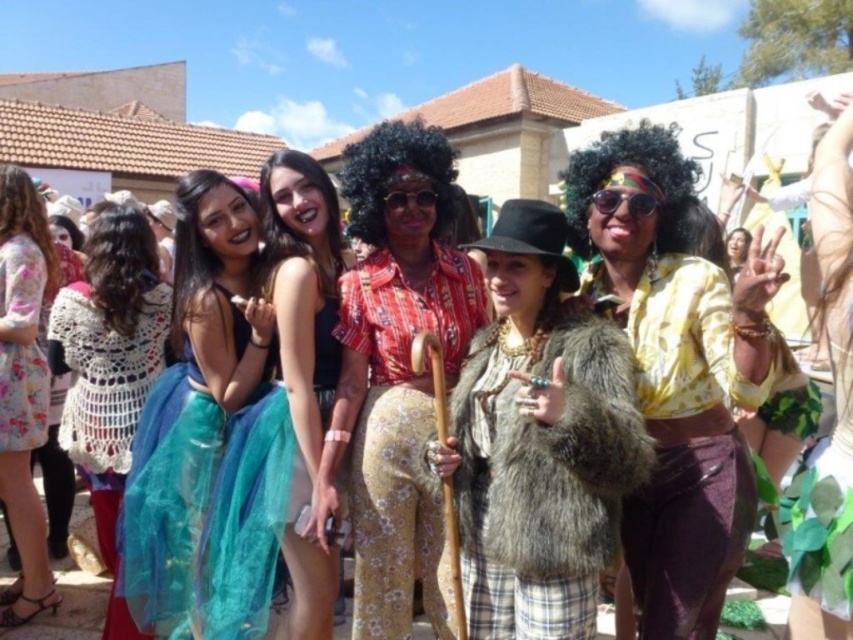
Is yellow tie-dye shirt at center thinner than crochet sweater at left?

No.

Who is shorter, yellow tie-dye shirt at center or crochet sweater at left?

yellow tie-dye shirt at center

Find the location of a particular element. yellow tie-dye shirt at center is located at coordinates (675, 368).

Does fur coat at center have a larger size compared to floral dress at left?

Yes, fur coat at center is bigger than floral dress at left.

Where is `fur coat at center`? fur coat at center is located at coordinates (538, 440).

Locate an element on the screen. The image size is (853, 640). fur coat at center is located at coordinates (538, 440).

Is the position of fur coat at center more distant than that of teal tulle skirt at center?

No, it is not.

You are a GUI agent. You are given a task and a screenshot of the screen. Output one action in this format:
    pyautogui.click(x=<x>, y=<y>)
    Task: Click on the fur coat at center
    
    Given the screenshot: What is the action you would take?
    pyautogui.click(x=538, y=440)